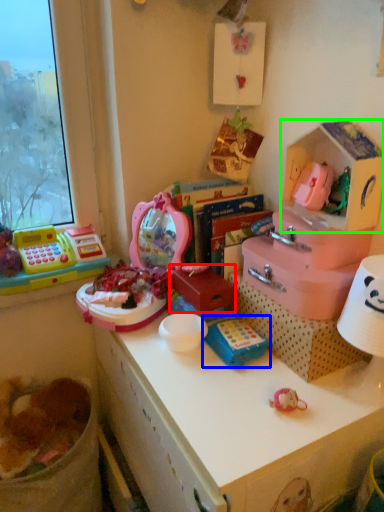
Question: Based on their relative distances, which object is farther from box (highlighted by a red box)? Choose from toy (highlighted by a blue box) and storage box (highlighted by a green box).

Choices:
 (A) toy
 (B) storage box

Answer: (B)